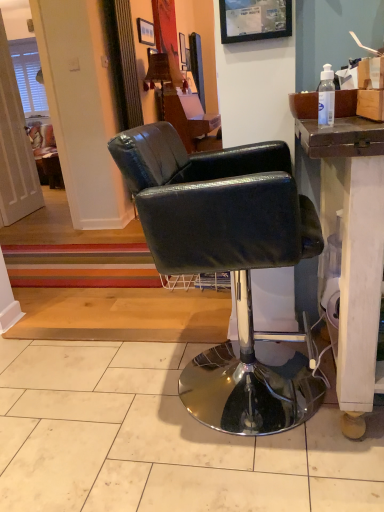
Question: Based on their sizes in the image, would you say black leather chair at center is bigger or smaller than matte black picture frame at upper center, which is counted as the 2th picture frame, starting from the front?

Choices:
 (A) small
 (B) big

Answer: (B)

Question: Do you think black leather chair at center is within matte black picture frame at upper center, which is counted as the 1th picture frame, starting from the back, or outside of it?

Choices:
 (A) outside
 (B) inside

Answer: (A)

Question: Estimate the real-world distances between objects in this image. Which object is farther from the wooden lampshade at upper center?

Choices:
 (A) matte plastic picture frame at upper center, the 1th picture frame when ordered from right to left
 (B) white tile at center
 (C) brown cardboard box at upper right
 (D) matte black picture frame at upper center, acting as the 1th picture frame starting from the left
 (E) black leather chair at center

Answer: (B)

Question: Which is nearer to the white tile at center?

Choices:
 (A) transparent plastic bottle at upper right
 (B) wooden lampshade at upper center
 (C) matte black picture frame at upper center, which is counted as the 2th picture frame, starting from the right
 (D) matte plastic picture frame at upper center, placed as the first picture frame when sorted from bottom to top
 (E) black leather chair at center

Answer: (E)